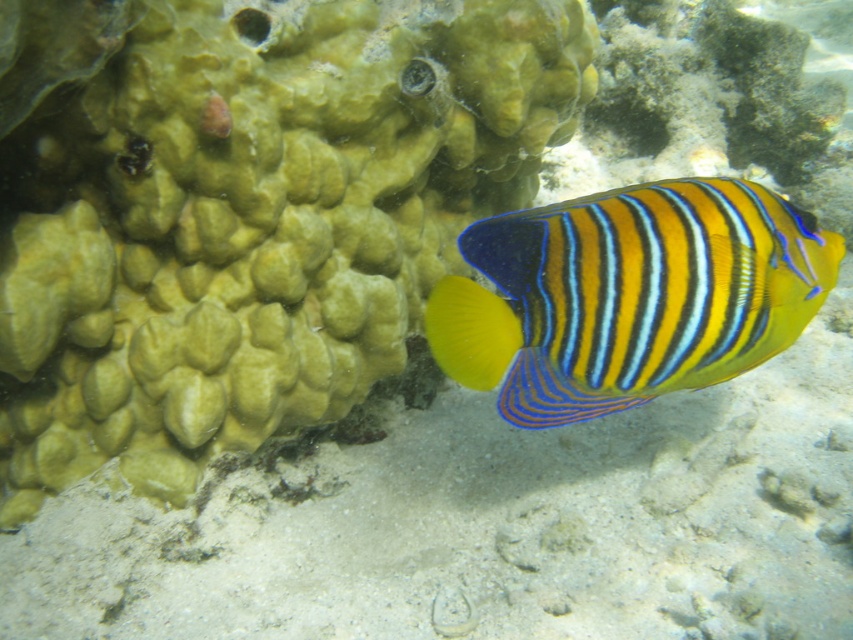
Can you confirm if green textured coral at center is smaller than yellow striped fish at center?

Actually, green textured coral at center might be larger than yellow striped fish at center.

Is green textured coral at center to the left of yellow striped fish at center from the viewer's perspective?

Yes, green textured coral at center is to the left of yellow striped fish at center.

What do you see at coordinates (247, 212) in the screenshot? I see `green textured coral at center` at bounding box center [247, 212].

The image size is (853, 640). I want to click on green textured coral at center, so click(x=247, y=212).